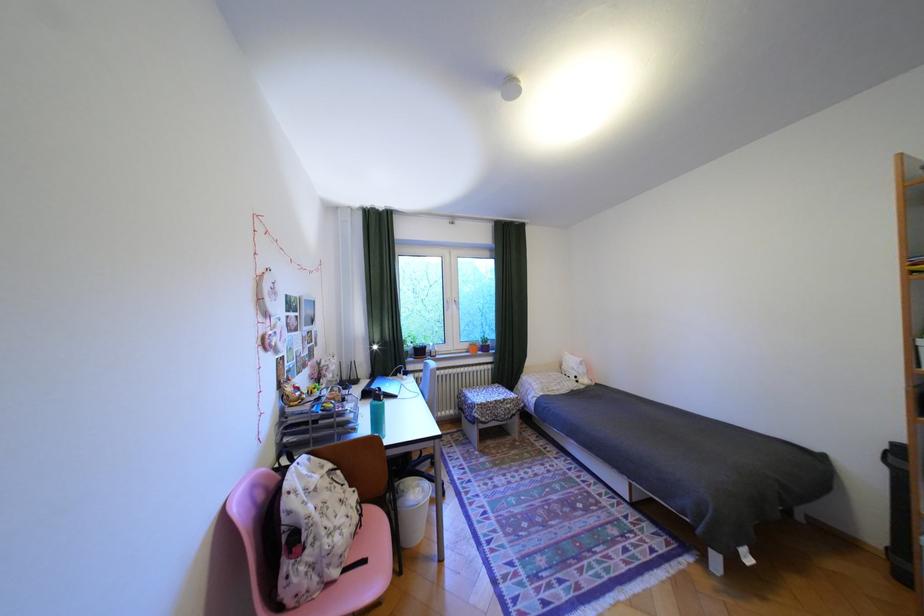
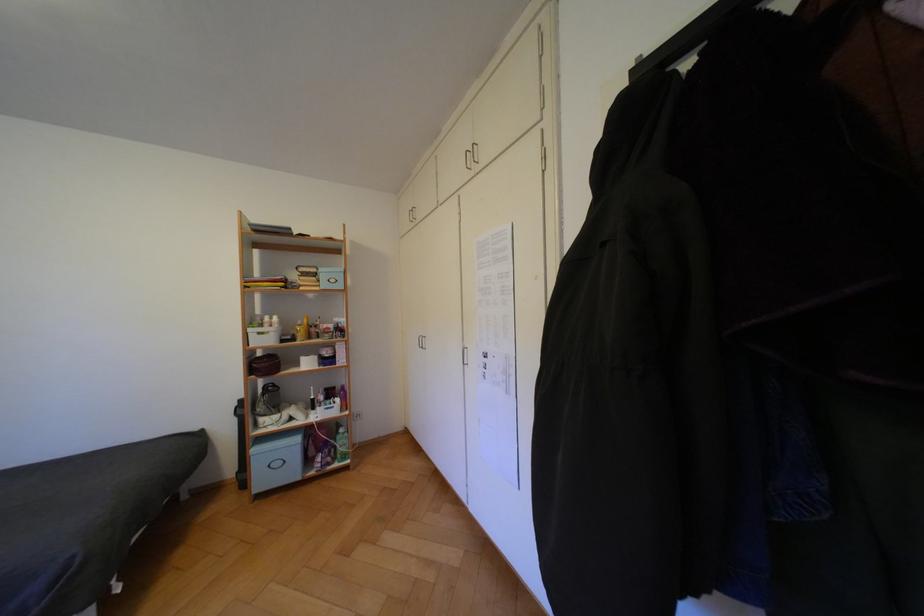
Question: The camera is either moving clockwise (left) or counter-clockwise (right) around the object. The first image is from the beginning of the video and the second image is from the end. Is the camera moving left or right when shooting the video?

Choices:
 (A) Left
 (B) Right

Answer: (A)